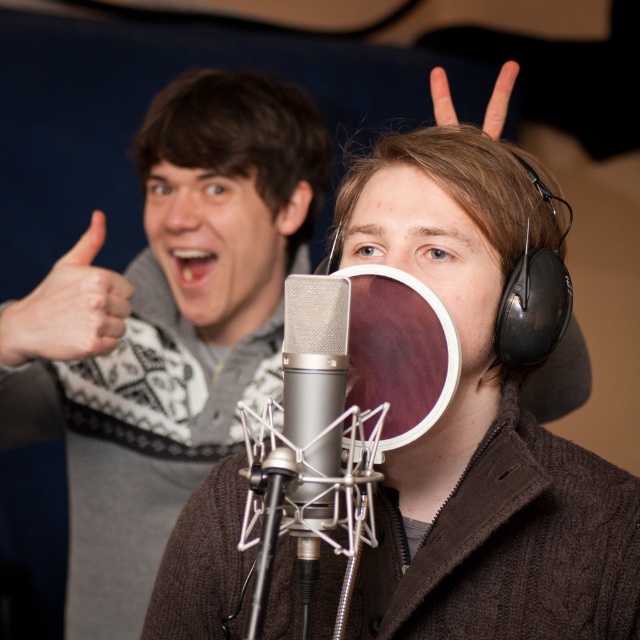
Question: Does silver metallic microphone at center appear on the right side of skinny-fingered hand at upper left?

Choices:
 (A) no
 (B) yes

Answer: (B)

Question: Which object is farther from the camera taking this photo?

Choices:
 (A) white matte hand at upper center
 (B) silver metallic microphone at center
 (C) skinny-fingered hand at upper left

Answer: (C)

Question: Considering the relative positions of silver metallic microphone at center and white matte hand at upper center in the image provided, where is silver metallic microphone at center located with respect to white matte hand at upper center?

Choices:
 (A) left
 (B) right

Answer: (A)

Question: Which of these objects is positioned farthest from the skinny-fingered hand at upper left?

Choices:
 (A) silver metallic microphone at center
 (B) white matte hand at upper center

Answer: (B)

Question: Which of these objects is positioned farthest from the skinny-fingered hand at upper left?

Choices:
 (A) silver metallic microphone at center
 (B) white matte hand at upper center

Answer: (B)

Question: Does silver metallic microphone at center appear under skinny-fingered hand at upper left?

Choices:
 (A) yes
 (B) no

Answer: (A)